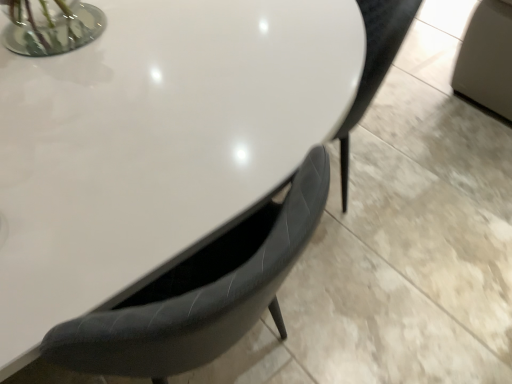
Question: Should I look upward or downward to see white glossy table at center?

Choices:
 (A) down
 (B) up

Answer: (A)